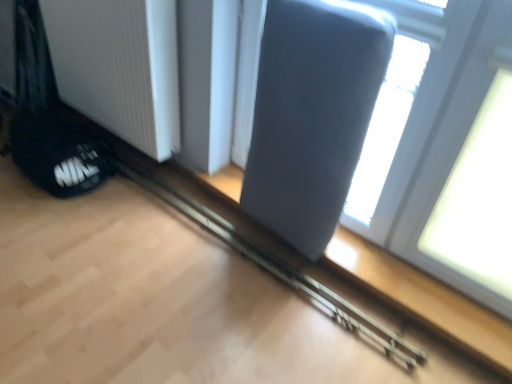
Find the location of a particular element. This screenshot has height=384, width=512. vacant region below metallic gray rail at center (from a real-world perspective) is located at coordinates (230, 236).